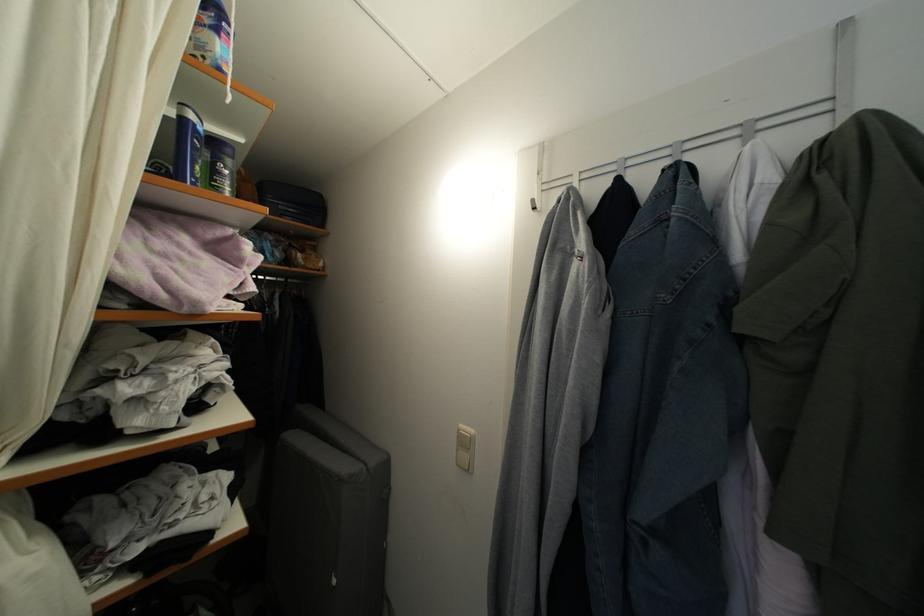
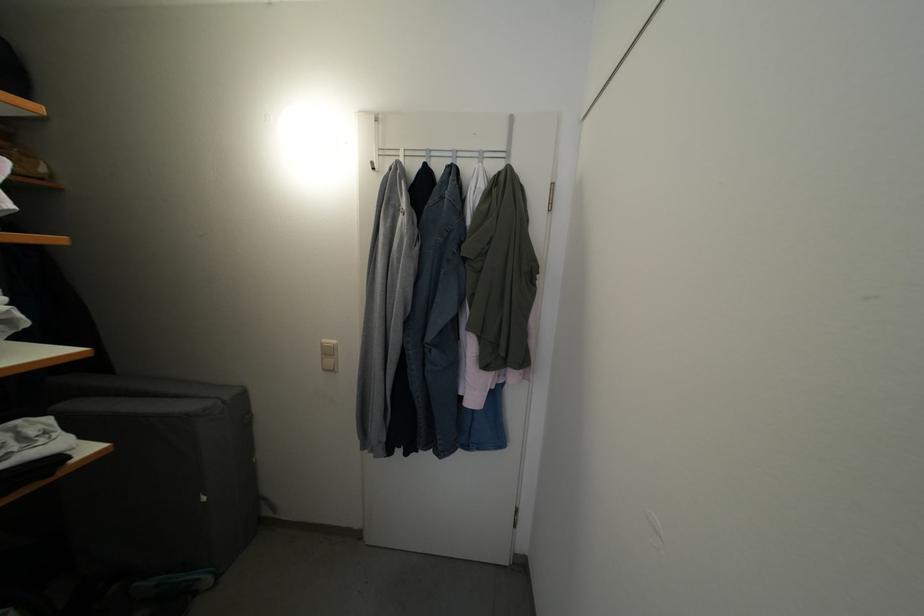
Question: The images are taken continuously from a first-person perspective. In which direction is your viewpoint rotating?

Choices:
 (A) Left
 (B) Right
 (C) Up
 (D) Down

Answer: (B)